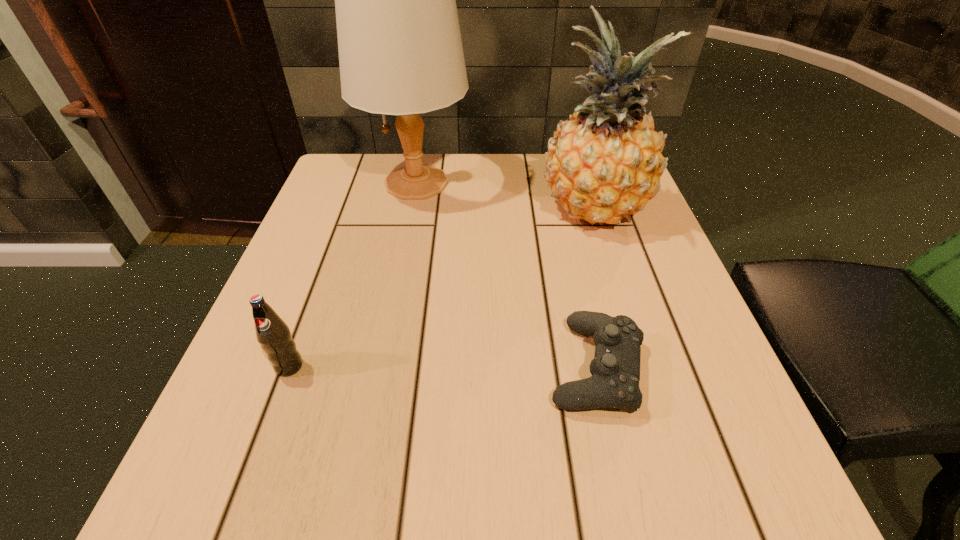
The width and height of the screenshot is (960, 540). Find the location of `table lamp`. table lamp is located at coordinates coord(400,51).

Locate an element on the screen. This screenshot has width=960, height=540. pineapple is located at coordinates (604, 162).

Where is `the second shortest object`? the second shortest object is located at coordinates (272, 333).

This screenshot has width=960, height=540. In order to click on the shortest object in this screenshot , I will do `click(615, 369)`.

Identify the location of free region located 0.090m on the right of the table lamp. This screenshot has height=540, width=960. (508, 183).

Locate an element on the screen. vacant space situated on the front of the pineapple is located at coordinates (641, 361).

Image resolution: width=960 pixels, height=540 pixels. Find the location of `vacant region located 0.060m on the front label of the third tallest object`. vacant region located 0.060m on the front label of the third tallest object is located at coordinates (272, 414).

Where is `vacant position located on the left of the shortest object`? The height and width of the screenshot is (540, 960). vacant position located on the left of the shortest object is located at coordinates (322, 366).

Identify the location of table lamp that is positioned at the far edge. The height and width of the screenshot is (540, 960). coord(400,51).

Where is `pineapple at the far edge`? The image size is (960, 540). pineapple at the far edge is located at coordinates (604, 162).